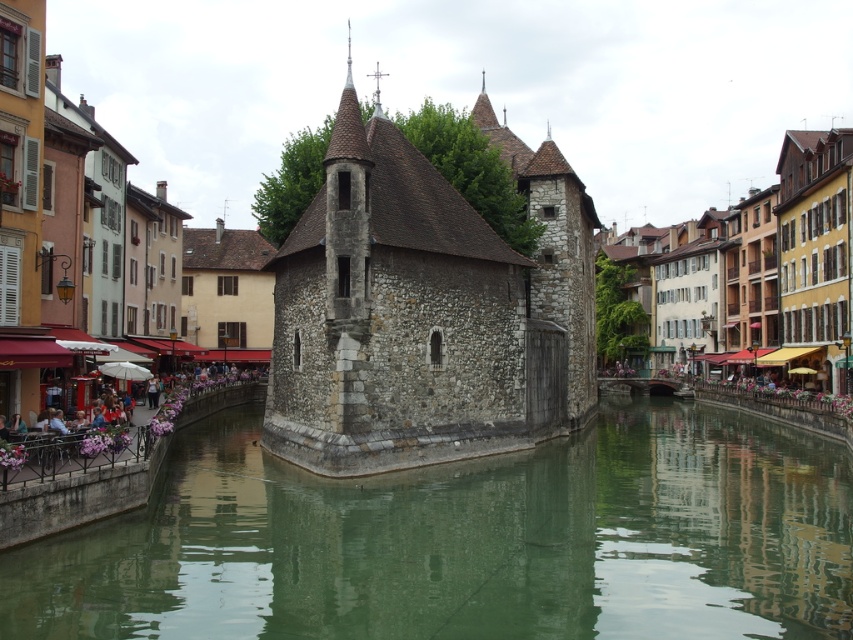
You are a tourist standing on the bridge overlooking the green stone water at center and the stone building at center. Which object occupies a larger area in the scene?

The stone building at center occupies a larger area than the green stone water at center.

You are standing on the dock and want to take a photo of the historic stone building. Where should you position yourself to ensure the green stone water at center is in the foreground of the photo?

To have the green stone water at center in the foreground, position yourself closer to the water since it is located at the center of the scene.

You are standing at the coordinates 0.5, 0.5 in the image. You want to walk to the stone building at center. In which direction should you move?

The stone building at center is located at point [467,84]. Since you are at [426,320], you should move to the left and slightly downward to reach it.